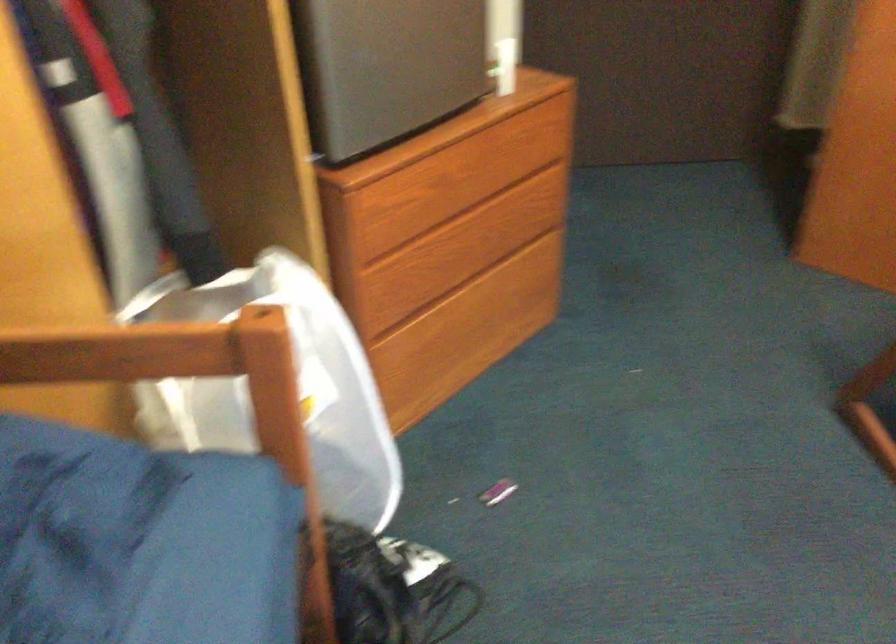
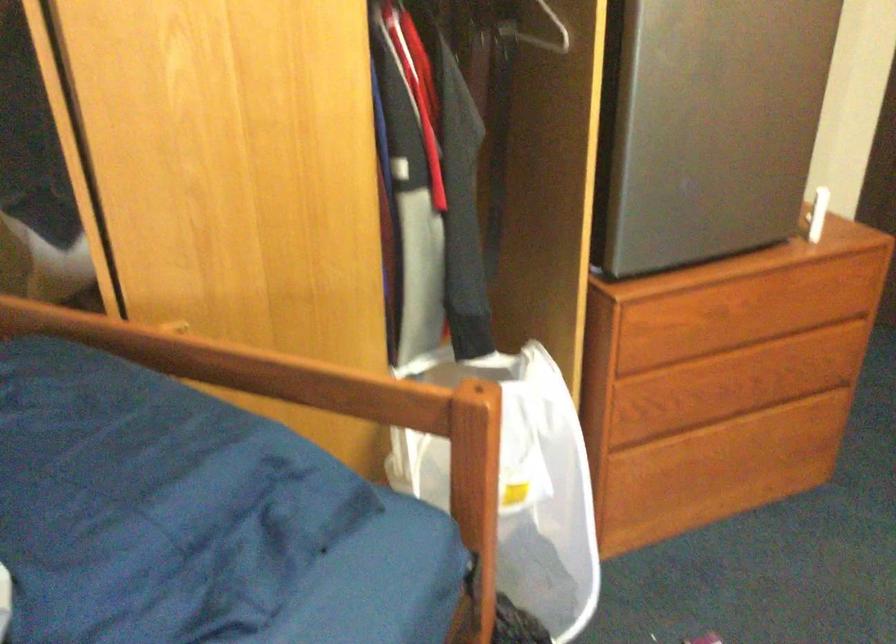
Which direction would the cameraman need to move to produce the second image?

The cameraman moved toward right, backward.